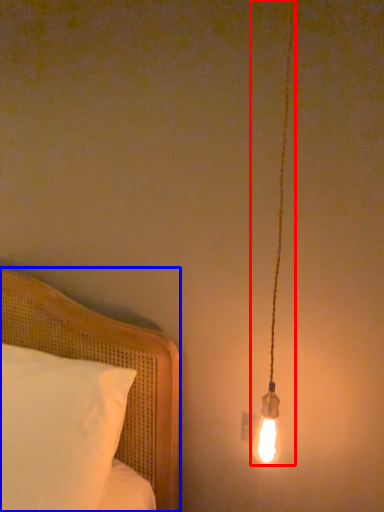
Question: Among these objects, which one is farthest to the camera, lamp (highlighted by a red box) or bed (highlighted by a blue box)?

Choices:
 (A) lamp
 (B) bed

Answer: (B)